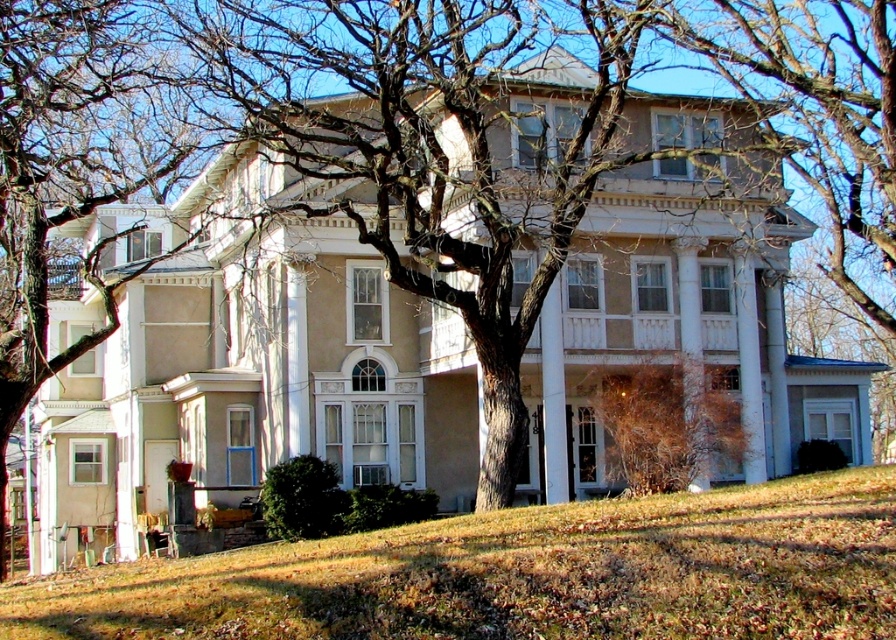
You are planning to place a new garden statue that is 3 meters wide between the brown bark tree at left and the brown dry bush at lower right. Based on the scene, will the statue fit in the space between them?

The brown bark tree at left is wider than the brown dry bush at lower right. However, the exact distance between them isn not specified in the provided information. Without knowing the space between the two objects, it is impossible to determine if the statue will fit.

You are standing in front of the classical house and want to place a small garden statue exactly at the point marked as point (522, 573). According to the image, what is the color of the ground at that specific location?

The brown grass at lower center is located at point (522, 573), so the ground at that location is brown.

You are standing at the front door of the classical house and see two points marked on the lawn. The first point is at coordinates point [168,616] and the second point is at point [33,124]. Which of these points is closer to you?

Point [168,616] is in front of point [33,124], so it is closer to you.